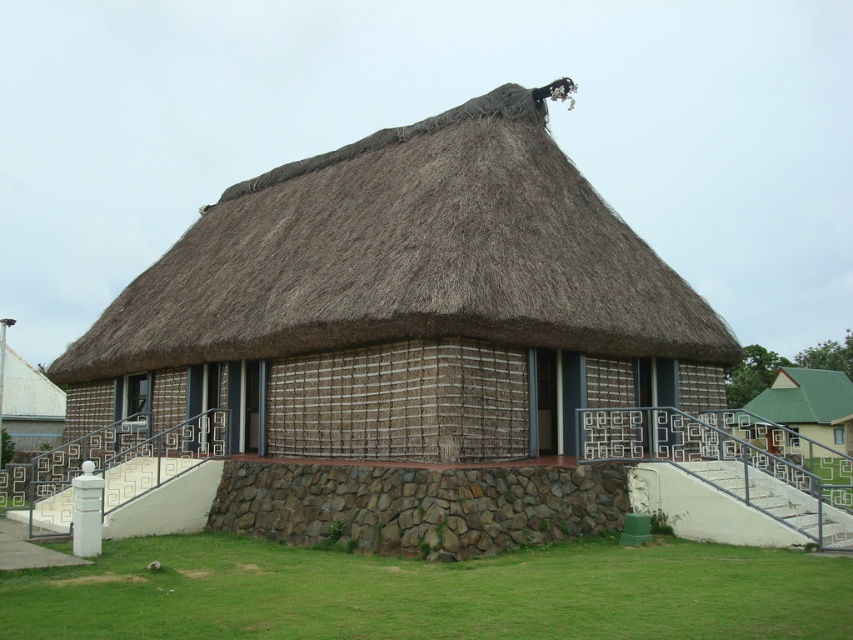
Where is `brown thatch at center`? The width and height of the screenshot is (853, 640). brown thatch at center is located at coordinates (405, 257).

Is brown thatch at center to the right of brown rough stone wall at center from the viewer's perspective?

Incorrect, brown thatch at center is not on the right side of brown rough stone wall at center.

Based on the photo, who is more distant from viewer, (531, 301) or (563, 492)?

The point (531, 301) is more distant.

Image resolution: width=853 pixels, height=640 pixels. What are the coordinates of `brown thatch at center` in the screenshot? It's located at (405, 257).

Which of these two, green grass at lower center or brown rough stone wall at center, stands taller?

With more height is brown rough stone wall at center.

Does green grass at lower center have a lesser height compared to brown rough stone wall at center?

Yes, green grass at lower center is shorter than brown rough stone wall at center.

The image size is (853, 640). I want to click on green grass at lower center, so click(x=431, y=593).

Who is lower down, brown thatch at center or green grass at lower center?

green grass at lower center

Which is more to the left, brown thatch at center or green grass at lower center?

brown thatch at center is more to the left.

Is point (521, 172) closer to camera compared to point (170, 566)?

No, (521, 172) is behind (170, 566).

At what (x,y) coordinates should I click in order to perform the action: click on brown thatch at center. Please return your answer as a coordinate pair (x, y). This screenshot has width=853, height=640. Looking at the image, I should click on (405, 257).